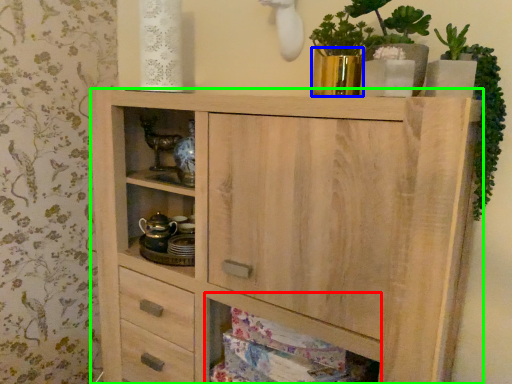
Question: Which object is positioned farthest from cabinet (highlighted by a red box)? Select from glass vase (highlighted by a blue box) and chest of drawers (highlighted by a green box).

Choices:
 (A) glass vase
 (B) chest of drawers

Answer: (A)